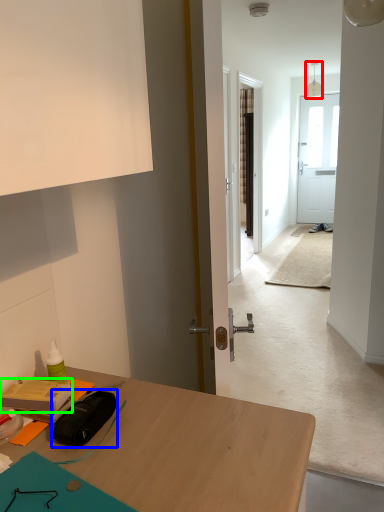
Question: Which object is positioned closest to lamp (highlighted by a red box)? Select from stationery (highlighted by a blue box) and stationery (highlighted by a green box).

Choices:
 (A) stationery
 (B) stationery

Answer: (B)